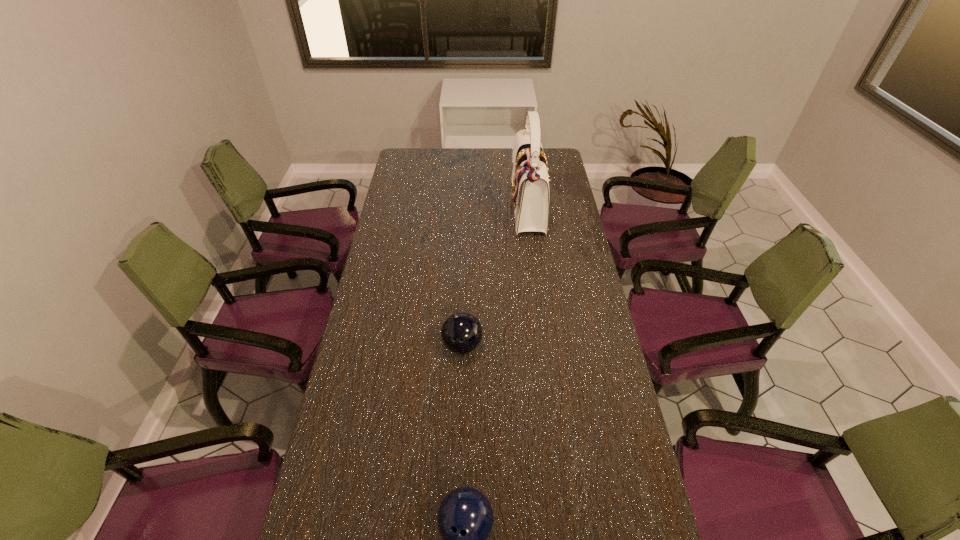
At what (x,y) coordinates should I click in order to perform the action: click on free location at the right edge. Please return your answer as a coordinate pair (x, y). The width and height of the screenshot is (960, 540). Looking at the image, I should click on (564, 230).

The height and width of the screenshot is (540, 960). What are the coordinates of `free space at the far left corner of the desktop` in the screenshot? It's located at (406, 171).

I want to click on vacant point at the far right corner, so click(557, 173).

Locate an element on the screen. The image size is (960, 540). object that is the second closest one to the nearer bowling ball is located at coordinates (530, 185).

The width and height of the screenshot is (960, 540). In order to click on the closest object relative to the farther bowling ball in this screenshot , I will do `click(465, 518)`.

I want to click on blank space that satisfies the following two spatial constraints: 1. on the front-facing side of the tallest object; 2. on the side of the second nearest object with the finger holes, so click(x=545, y=346).

This screenshot has height=540, width=960. In order to click on vacant area in the image that satisfies the following two spatial constraints: 1. on the front-facing side of the tallest object; 2. on the side of the second nearest object with the finger holes in this screenshot , I will do `click(545, 346)`.

Locate an element on the screen. This screenshot has height=540, width=960. free space in the image that satisfies the following two spatial constraints: 1. on the front-facing side of the farthest object; 2. on the side of the second nearest object with the finger holes is located at coordinates (545, 346).

Locate an element on the screen. free location that satisfies the following two spatial constraints: 1. on the front-facing side of the farthest object; 2. on the side of the farther bowling ball with the finger holes is located at coordinates (545, 346).

This screenshot has height=540, width=960. In order to click on free space that satisfies the following two spatial constraints: 1. on the front-facing side of the farthest object; 2. on the side of the second nearest object with the finger holes in this screenshot , I will do `click(545, 346)`.